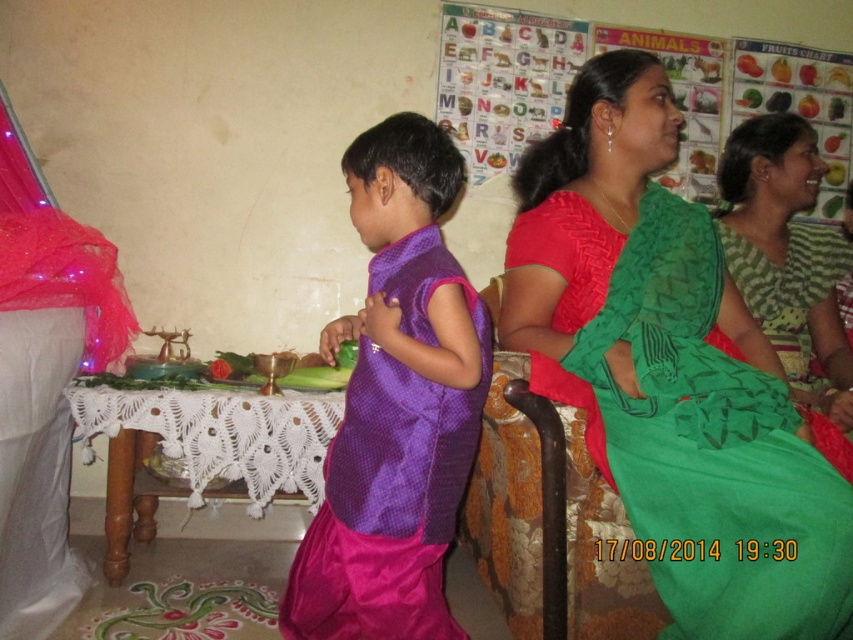
You are a guest at this event and want to sit at the white lace table at lower center. Which side of the green silk saree at center should you walk around to reach the table?

To reach the white lace table at lower center, you should walk around the left side of the green silk saree at center since the saree is to the right of the table.

You are a photographer positioned at the entrance of the room. You need to capture a photo that includes both the purple silk sari at center and the white lace table at lower center. Which object will appear larger in the photo?

The purple silk sari at center will appear larger in the photo because it is closer to the viewer than the white lace table at lower center.